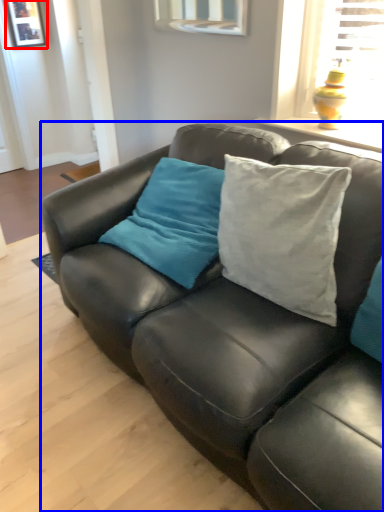
Question: Which object appears farthest to the camera in this image, picture frame (highlighted by a red box) or studio couch (highlighted by a blue box)?

Choices:
 (A) picture frame
 (B) studio couch

Answer: (A)